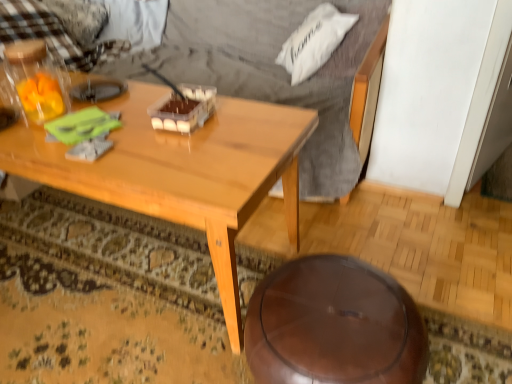
Question: Is translucent plastic bottle at upper left positioned in front of shiny brown stool at lower center?

Choices:
 (A) yes
 (B) no

Answer: (B)

Question: From a real-world perspective, is translucent plastic bottle at upper left physically above shiny brown stool at lower center?

Choices:
 (A) yes
 (B) no

Answer: (A)

Question: Is translucent plastic bottle at upper left outside of shiny brown stool at lower center?

Choices:
 (A) yes
 (B) no

Answer: (A)

Question: Can you confirm if translucent plastic bottle at upper left is shorter than shiny brown stool at lower center?

Choices:
 (A) no
 (B) yes

Answer: (B)

Question: Does translucent plastic bottle at upper left turn towards shiny brown stool at lower center?

Choices:
 (A) no
 (B) yes

Answer: (A)

Question: Is translucent plastic bottle at upper left at the right side of shiny brown stool at lower center?

Choices:
 (A) yes
 (B) no

Answer: (B)

Question: Is checkered fabric pillow at upper left, acting as the first pillow starting from the left, completely or partially outside of shiny brown stool at lower center?

Choices:
 (A) no
 (B) yes

Answer: (B)

Question: From a real-world perspective, does checkered fabric pillow at upper left, acting as the first pillow starting from the left, stand above shiny brown stool at lower center?

Choices:
 (A) yes
 (B) no

Answer: (A)

Question: Is the depth of checkered fabric pillow at upper left, which is the second pillow from right to left, greater than that of shiny brown stool at lower center?

Choices:
 (A) no
 (B) yes

Answer: (B)

Question: Is checkered fabric pillow at upper left, placed as the 2th pillow when sorted from front to back, wider than shiny brown stool at lower center?

Choices:
 (A) no
 (B) yes

Answer: (A)

Question: Is the depth of checkered fabric pillow at upper left, the 1th pillow when ordered from back to front, less than that of shiny brown stool at lower center?

Choices:
 (A) yes
 (B) no

Answer: (B)

Question: Would you consider checkered fabric pillow at upper left, the 1th pillow when ordered from back to front, to be distant from shiny brown stool at lower center?

Choices:
 (A) yes
 (B) no

Answer: (A)

Question: From the image's perspective, is checkered fabric pillow at upper left, placed as the 2th pillow when sorted from front to back, over light brown wood coffee table at center?

Choices:
 (A) yes
 (B) no

Answer: (A)